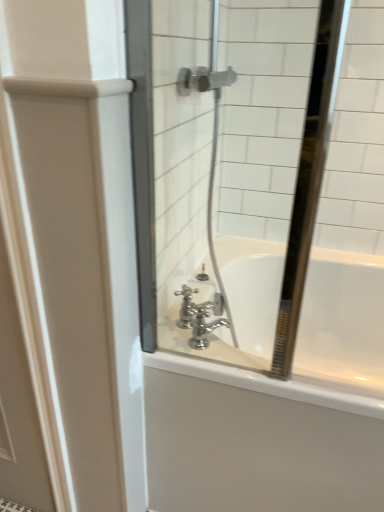
Question: Considering the relative sizes of clear glass mirror at center and white glossy door at left in the image provided, is clear glass mirror at center bigger than white glossy door at left?

Choices:
 (A) no
 (B) yes

Answer: (B)

Question: Is clear glass mirror at center further to camera compared to white glossy door at left?

Choices:
 (A) no
 (B) yes

Answer: (A)

Question: Does clear glass mirror at center have a greater height compared to white glossy door at left?

Choices:
 (A) yes
 (B) no

Answer: (B)

Question: Is white glossy door at left at the back of clear glass mirror at center?

Choices:
 (A) no
 (B) yes

Answer: (A)

Question: From the image's perspective, would you say clear glass mirror at center is positioned over white glossy door at left?

Choices:
 (A) yes
 (B) no

Answer: (A)

Question: From the image's perspective, is white glossy bathtub at center above or below chrome metallic faucet at center?

Choices:
 (A) below
 (B) above

Answer: (A)

Question: Considering the relative positions of white glossy bathtub at center and chrome metallic faucet at center in the image provided, is white glossy bathtub at center to the left or to the right of chrome metallic faucet at center?

Choices:
 (A) right
 (B) left

Answer: (A)

Question: Considering their positions, is white glossy bathtub at center located in front of or behind chrome metallic faucet at center?

Choices:
 (A) front
 (B) behind

Answer: (A)

Question: From their relative heights in the image, would you say white glossy bathtub at center is taller or shorter than chrome metallic faucet at center?

Choices:
 (A) short
 (B) tall

Answer: (B)

Question: Considering their positions, is clear glass mirror at center located in front of or behind white glossy bathtub at center?

Choices:
 (A) front
 (B) behind

Answer: (A)

Question: Is clear glass mirror at center to the left or to the right of white glossy bathtub at center in the image?

Choices:
 (A) right
 (B) left

Answer: (B)

Question: Looking at their shapes, would you say clear glass mirror at center is wider or thinner than white glossy bathtub at center?

Choices:
 (A) wide
 (B) thin

Answer: (B)

Question: From the image's perspective, is clear glass mirror at center located above or below white glossy bathtub at center?

Choices:
 (A) below
 (B) above

Answer: (B)

Question: Considering the positions of white glossy door at left and white glossy bathtub at center in the image, is white glossy door at left taller or shorter than white glossy bathtub at center?

Choices:
 (A) short
 (B) tall

Answer: (B)

Question: From the image's perspective, is white glossy door at left located above or below white glossy bathtub at center?

Choices:
 (A) above
 (B) below

Answer: (A)